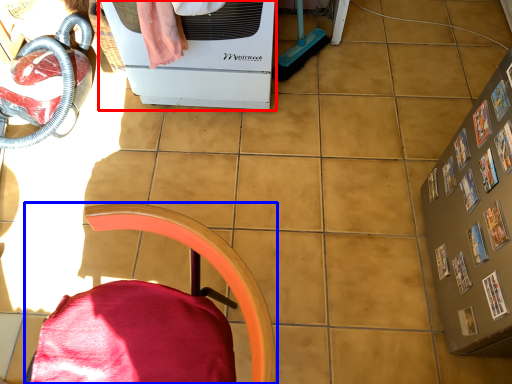
Question: Which object is further to the camera taking this photo, home appliance (highlighted by a red box) or furniture (highlighted by a blue box)?

Choices:
 (A) home appliance
 (B) furniture

Answer: (A)